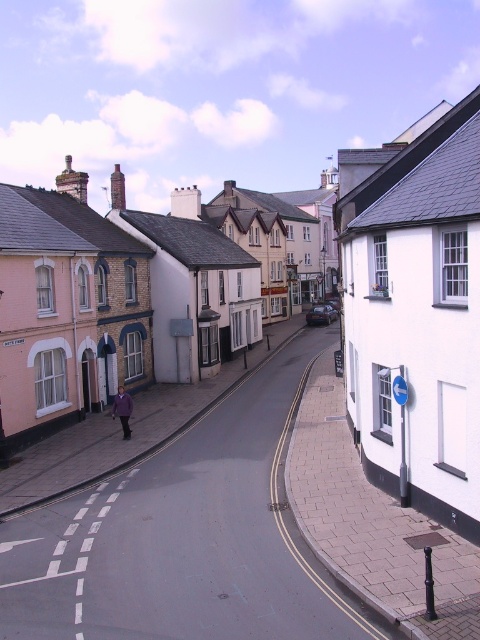
This screenshot has height=640, width=480. What do you see at coordinates (416, 312) in the screenshot? I see `white matte building at center` at bounding box center [416, 312].

Can you confirm if white matte building at center is positioned to the left of purple fabric jacket at center?

In fact, white matte building at center is to the right of purple fabric jacket at center.

Who is more distant from viewer, (380, 227) or (120, 390)?

The point (120, 390) is more distant.

This screenshot has width=480, height=640. I want to click on white matte building at center, so click(x=416, y=312).